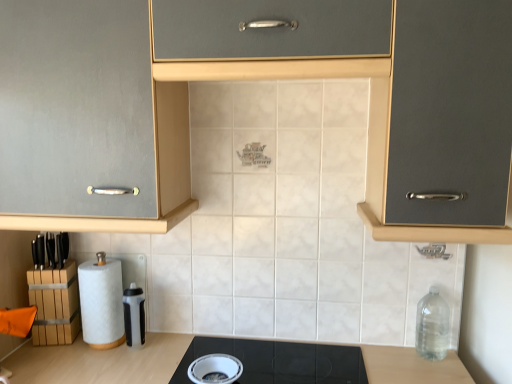
Question: Considering the relative sizes of black glass cooktop at center and matte gray cabinet at center in the image provided, is black glass cooktop at center wider than matte gray cabinet at center?

Choices:
 (A) no
 (B) yes

Answer: (A)

Question: From the image's perspective, is black glass cooktop at center over matte gray cabinet at center?

Choices:
 (A) no
 (B) yes

Answer: (A)

Question: Does black glass cooktop at center appear on the right side of matte gray cabinet at center?

Choices:
 (A) yes
 (B) no

Answer: (A)

Question: Does black glass cooktop at center have a lesser height compared to matte gray cabinet at center?

Choices:
 (A) yes
 (B) no

Answer: (A)

Question: Is black glass cooktop at center touching matte gray cabinet at center?

Choices:
 (A) no
 (B) yes

Answer: (A)

Question: Would you say translucent plastic water bottle at lower center, the first appliance when ordered from left to right, is to the left or to the right of black glass cooktop at center in the picture?

Choices:
 (A) right
 (B) left

Answer: (B)

Question: Is translucent plastic water bottle at lower center, acting as the second appliance starting from the front, bigger or smaller than black glass cooktop at center?

Choices:
 (A) big
 (B) small

Answer: (B)

Question: Relative to black glass cooktop at center, is translucent plastic water bottle at lower center, acting as the second appliance starting from the front, in front or behind?

Choices:
 (A) front
 (B) behind

Answer: (B)

Question: In terms of height, does translucent plastic water bottle at lower center, placed as the first appliance when sorted from top to bottom, look taller or shorter compared to black glass cooktop at center?

Choices:
 (A) short
 (B) tall

Answer: (B)

Question: Looking at the image, does clear plastic bottle at right seem bigger or smaller compared to matte gray cabinet at center?

Choices:
 (A) big
 (B) small

Answer: (B)

Question: Is clear plastic bottle at right wider or thinner than matte gray cabinet at center?

Choices:
 (A) wide
 (B) thin

Answer: (B)

Question: From the image's perspective, relative to matte gray cabinet at center, is clear plastic bottle at right above or below?

Choices:
 (A) above
 (B) below

Answer: (B)

Question: Relative to matte gray cabinet at center, is clear plastic bottle at right in front or behind?

Choices:
 (A) front
 (B) behind

Answer: (B)

Question: From the image's perspective, is matte gray cabinet at center positioned above or below white glossy bowl at lower center, which is counted as the 1th appliance, starting from the front?

Choices:
 (A) above
 (B) below

Answer: (A)

Question: Based on their sizes in the image, would you say matte gray cabinet at center is bigger or smaller than white glossy bowl at lower center, marked as the first appliance in a right-to-left arrangement?

Choices:
 (A) small
 (B) big

Answer: (B)